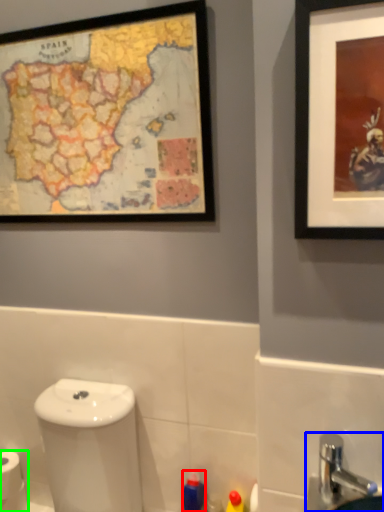
Question: Considering the real-world distances, which object is closest to toiletry (highlighted by a red box)? sink (highlighted by a blue box) or toilet paper (highlighted by a green box).

Choices:
 (A) sink
 (B) toilet paper

Answer: (A)